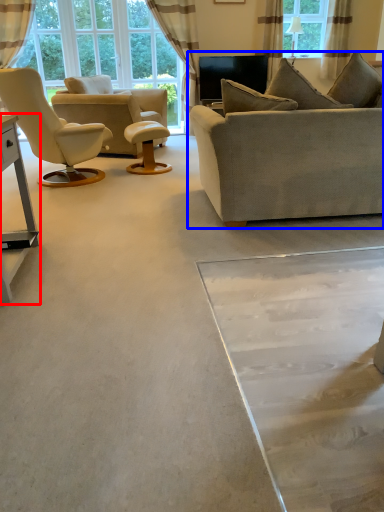
Question: Which of the following is the farthest to the observer, table (highlighted by a red box) or studio couch (highlighted by a blue box)?

Choices:
 (A) table
 (B) studio couch

Answer: (B)